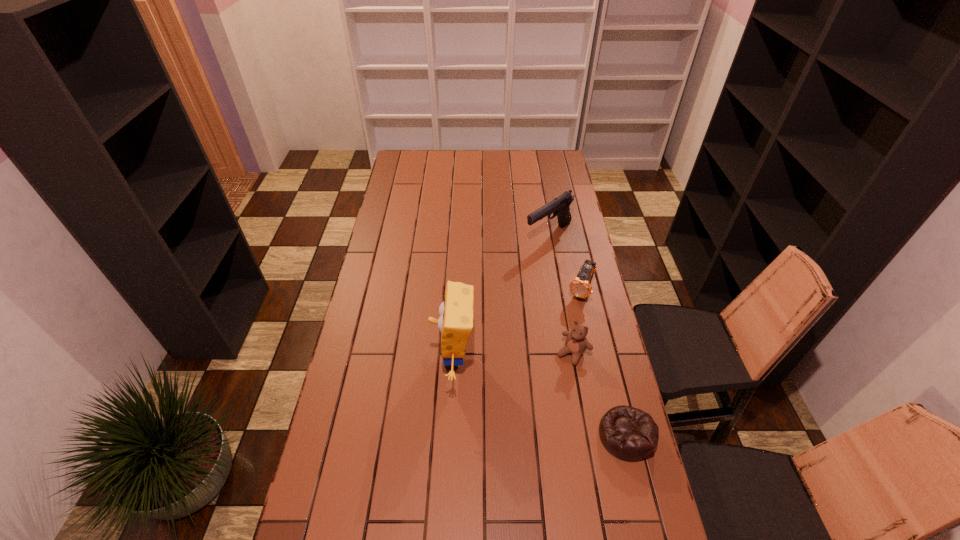
Where is `vacant space that is in between the teddy bear and the leftmost object`? vacant space that is in between the teddy bear and the leftmost object is located at coordinates (514, 356).

Find the location of a particular element. free space between the fourth nearest object and the gun is located at coordinates (564, 264).

Image resolution: width=960 pixels, height=540 pixels. I want to click on vacant point located between the teddy bear and the sponge, so click(514, 356).

Where is `free space between the second tallest object and the teddy bear`? The image size is (960, 540). free space between the second tallest object and the teddy bear is located at coordinates (561, 294).

The image size is (960, 540). Identify the location of free point between the sponge and the second tallest object. (501, 297).

Find the location of `empty space that is in between the watch and the beanbag`. empty space that is in between the watch and the beanbag is located at coordinates (603, 363).

You are a GUI agent. You are given a task and a screenshot of the screen. Output one action in this format:
    pyautogui.click(x=<x>, y=<y>)
    Task: Click on the vacant region between the second farthest object and the tallest object
    
    Given the screenshot: What is the action you would take?
    pyautogui.click(x=517, y=325)

Where is `free space that is in between the sponge and the fourth nearest object`? The width and height of the screenshot is (960, 540). free space that is in between the sponge and the fourth nearest object is located at coordinates (517, 325).

Locate an element on the screen. This screenshot has width=960, height=540. empty location between the shortest object and the leftmost object is located at coordinates (540, 397).

Where is `vacant region between the watch and the farthest object`? The height and width of the screenshot is (540, 960). vacant region between the watch and the farthest object is located at coordinates [564, 264].